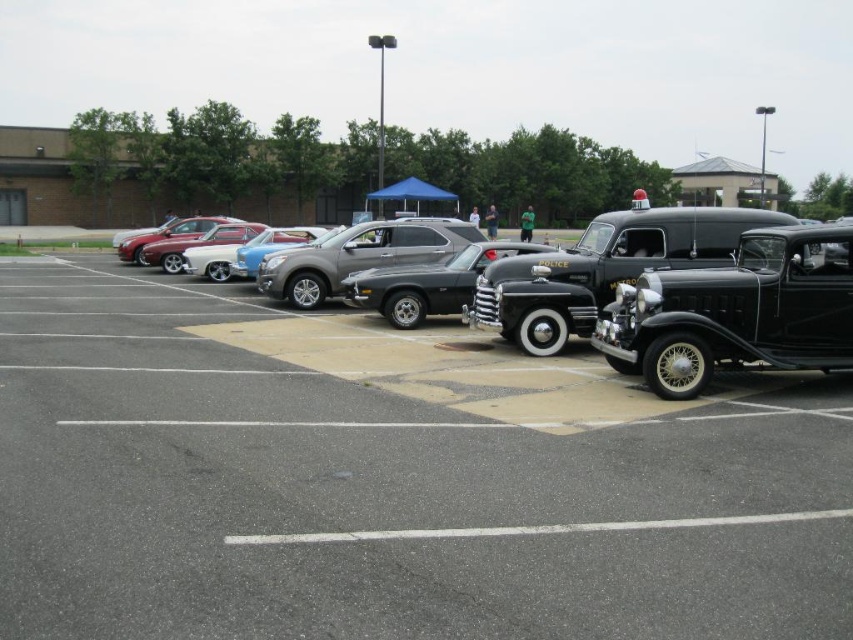
Between point (378, 227) and point (123, 252), which one is positioned behind?

The point (123, 252) is behind.

Who is positioned more to the right, satin silver suv at center or shiny silver sedan at center?

Positioned to the right is satin silver suv at center.

Is point (364, 228) in front of point (137, 244)?

Yes, point (364, 228) is in front of point (137, 244).

At what (x,y) coordinates should I click in order to perform the action: click on satin silver suv at center. Please return your answer as a coordinate pair (x, y). The height and width of the screenshot is (640, 853). Looking at the image, I should click on (358, 256).

Measure the distance between shiny black police car at center and camera.

A distance of 8.56 meters exists between shiny black police car at center and camera.

What do you see at coordinates (679, 289) in the screenshot?
I see `shiny black police car at center` at bounding box center [679, 289].

Which is behind, point (636, 262) or point (750, 524)?

Point (636, 262)

Where is `shiny black police car at center`? shiny black police car at center is located at coordinates [x=679, y=289].

Consider the image. Does shiny black car at right have a lesser width compared to shiny black car at center?

Indeed, shiny black car at right has a lesser width compared to shiny black car at center.

Which is more to the left, shiny black car at right or shiny black car at center?

From the viewer's perspective, shiny black car at center appears more on the left side.

In order to click on shiny black car at right in this screenshot , I will do `click(735, 310)`.